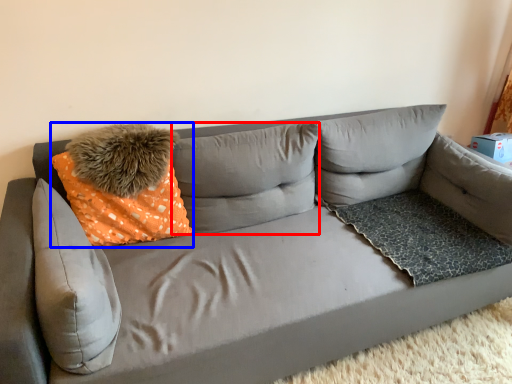
Question: Among these objects, which one is nearest to the camera, pillow (highlighted by a red box) or throw pillow (highlighted by a blue box)?

Choices:
 (A) pillow
 (B) throw pillow

Answer: (B)